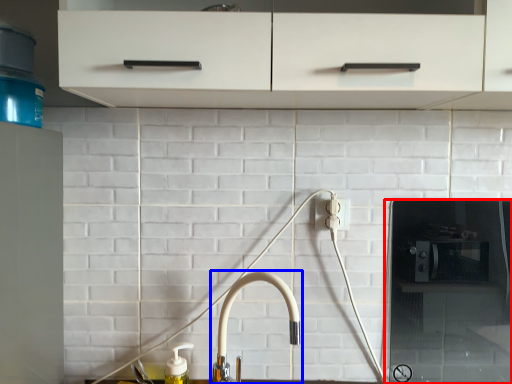
Question: Among these objects, which one is nearest to the camera, appliance (highlighted by a red box) or tap (highlighted by a blue box)?

Choices:
 (A) appliance
 (B) tap

Answer: (B)